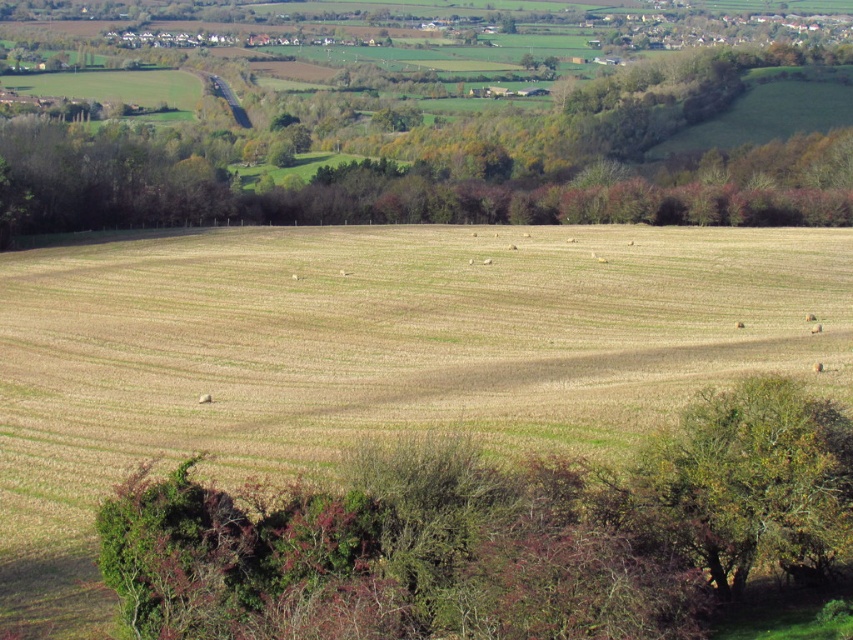
You are standing at the point with coordinates point (48, 428) and want to walk towards the point with coordinates point (689, 474). Will you have to go through any obstacles in the scene?

The point (48, 428) is behind point (689, 474), so you will not have to go through any obstacles because you are already behind the target point.